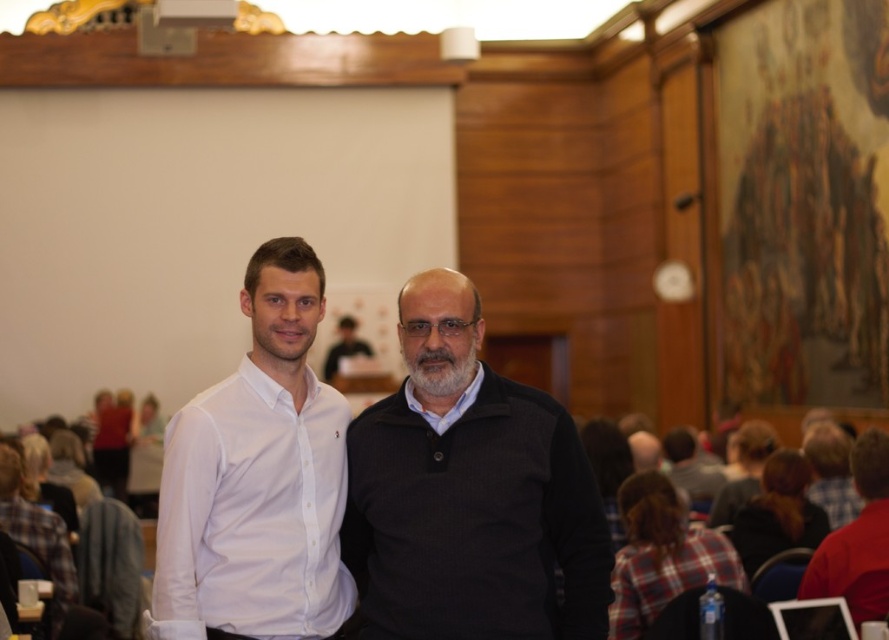
You are an event planner setting up cameras for a live stream. You need to ensure both the white matte shirt at center and the red matte shirt at lower right are visible in the frame. Based on their positions, which shirt should you focus on first to capture both in the shot?

The white matte shirt at center is above the red matte shirt at lower right, so focusing on the white matte shirt at center first will allow the camera to capture both shirts in the frame since it is positioned higher.

You are an event planner trying to place a name tag on the dark gray sweater at center. If the coordinate system starts at the bottom left corner of the image, what are the x and y coordinates where you should place the name tag?

The dark gray sweater at center is located at coordinates x 0.770 and y 0.529, so the name tag should be placed at those coordinates.

You are a photographer standing in the front of the conference room. You want to take a photo of the dark gray sweater at center and the matte black shirt at center. Which one will appear larger in your photo?

The dark gray sweater at center will appear larger in the photo because it is closer to the viewer than the matte black shirt at center.